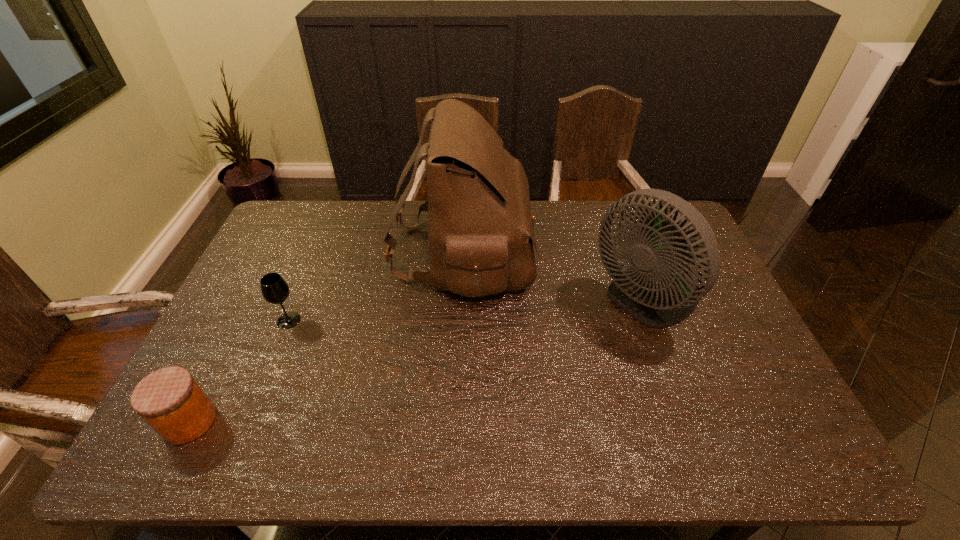
The height and width of the screenshot is (540, 960). What are the coordinates of `the tallest object` in the screenshot? It's located at (480, 227).

Where is `satchel`? The image size is (960, 540). satchel is located at coordinates (480, 227).

I want to click on fan, so click(651, 290).

You are a GUI agent. You are given a task and a screenshot of the screen. Output one action in this format:
    pyautogui.click(x=<x>, y=<y>)
    Task: Click on the third shortest object
    
    Given the screenshot: What is the action you would take?
    pyautogui.click(x=651, y=290)

Locate an element on the screen. This screenshot has height=540, width=960. the third object from right to left is located at coordinates (274, 289).

The width and height of the screenshot is (960, 540). In order to click on the leftmost object in this screenshot , I will do `click(169, 399)`.

Locate an element on the screen. the shortest object is located at coordinates (169, 399).

The height and width of the screenshot is (540, 960). What are the coordinates of `vacant space located 0.260m on the front flap of the tallest object` in the screenshot? It's located at (609, 253).

At what (x,y) coordinates should I click in order to perform the action: click on free space located 0.340m in front of the rightmost object to direct airflow. Please return your answer as a coordinate pair (x, y). This screenshot has width=960, height=540. Looking at the image, I should click on (477, 302).

Find the location of a particular element. The width and height of the screenshot is (960, 540). free location located in front of the rightmost object to direct airflow is located at coordinates (550, 302).